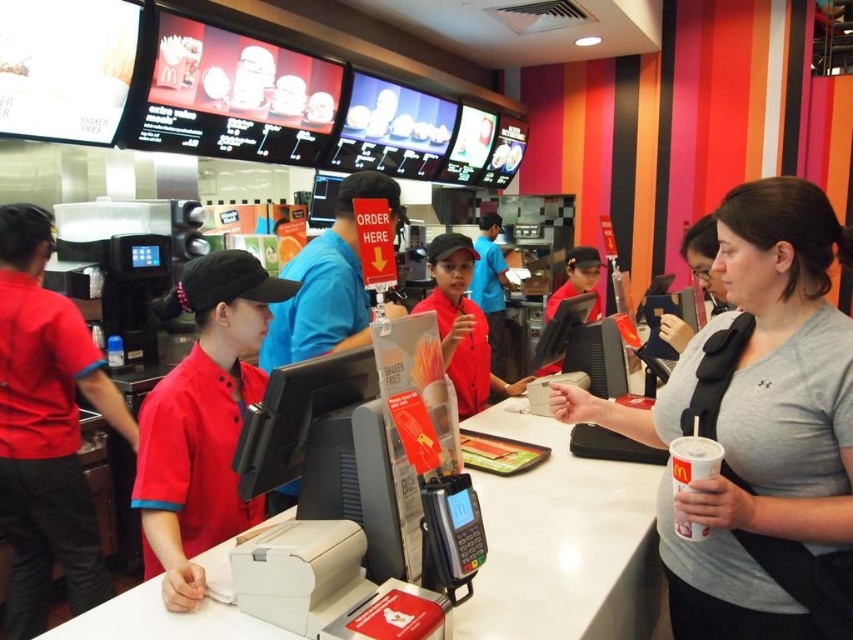
Question: Can you confirm if gray matte shirt at center is positioned above white paper cup at lower right?

Choices:
 (A) yes
 (B) no

Answer: (A)

Question: Which point appears farthest from the camera in this image?

Choices:
 (A) (694, 340)
 (B) (670, 456)

Answer: (A)

Question: Does gray matte shirt at center appear over white paper cup at lower right?

Choices:
 (A) yes
 (B) no

Answer: (A)

Question: Is gray matte shirt at center in front of white paper cup at lower right?

Choices:
 (A) yes
 (B) no

Answer: (B)

Question: Which point is farther from the camera taking this photo?

Choices:
 (A) (723, 609)
 (B) (697, 452)

Answer: (A)